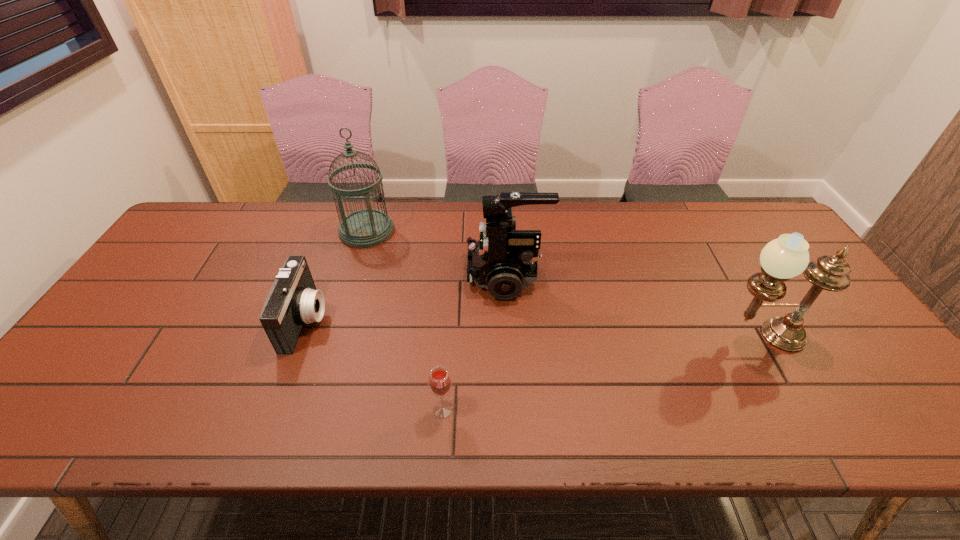
In the image, there is a desktop. At what (x,y) coordinates should I click in order to perform the action: click on vacant region at the near left corner. Please return your answer as a coordinate pair (x, y). Looking at the image, I should click on (43, 430).

This screenshot has width=960, height=540. In order to click on vacant space at the far right corner of the desktop in this screenshot , I will do `click(740, 236)`.

Where is `vacant area at the near right corner`? vacant area at the near right corner is located at coordinates (855, 408).

At what (x,y) coordinates should I click in order to perform the action: click on empty space between the third object from left to right and the shorter camcorder. Please return your answer as a coordinate pair (x, y). The width and height of the screenshot is (960, 540). Looking at the image, I should click on (374, 364).

Locate an element on the screen. The width and height of the screenshot is (960, 540). vacant region between the right camcorder and the birdcage is located at coordinates (437, 253).

In order to click on vacant space in between the left camcorder and the oil lamp in this screenshot , I will do `click(533, 328)`.

In order to click on vacant area that lies between the third shortest object and the shorter camcorder in this screenshot , I will do `click(406, 298)`.

Image resolution: width=960 pixels, height=540 pixels. Identify the location of free space that is in between the birdcage and the right camcorder. (437, 253).

Locate an element on the screen. free space between the farthest object and the shorter camcorder is located at coordinates (336, 275).

Where is `free space between the third object from left to right and the oil lamp`? free space between the third object from left to right and the oil lamp is located at coordinates (602, 373).